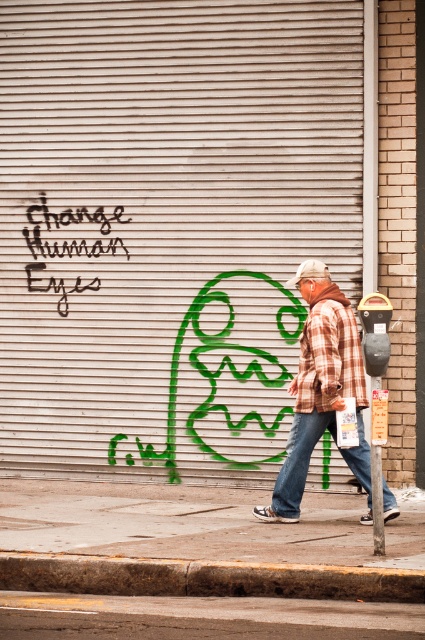
You are a delivery person who needs to avoid the black graffiti at upper left while delivering a package to the closed metal security door. What is the safest path to take around the door?

The safest path would be to approach the closed metal security door from the right side, as the black graffiti at upper left is located at point (68,243) and is on the opposite side of the door from where you are walking. This ensures you avoid the graffiti area while reaching the door efficiently.

You are a delivery person who needs to attach a 1.2 meter long package to your bike rack. The rack can only hold items shorter than 1 meter. Looking at the scene, can you use the black graffiti at upper left or the black plastic parking meter at right as a reference to estimate if the package will fit?

The black graffiti at upper left is taller than the black plastic parking meter at right. Since the package is 1.2 meters long, which exceeds the 1 meter limit, it won

You are a street artist planning to add a new piece next to the black graffiti at upper left and the black plastic parking meter at right. Which object has a larger width so you can decide where to place your artwork?

The black graffiti at upper left has a larger width than the black plastic parking meter at right, so you should consider placing your artwork next to the black graffiti at upper left to accommodate its size.